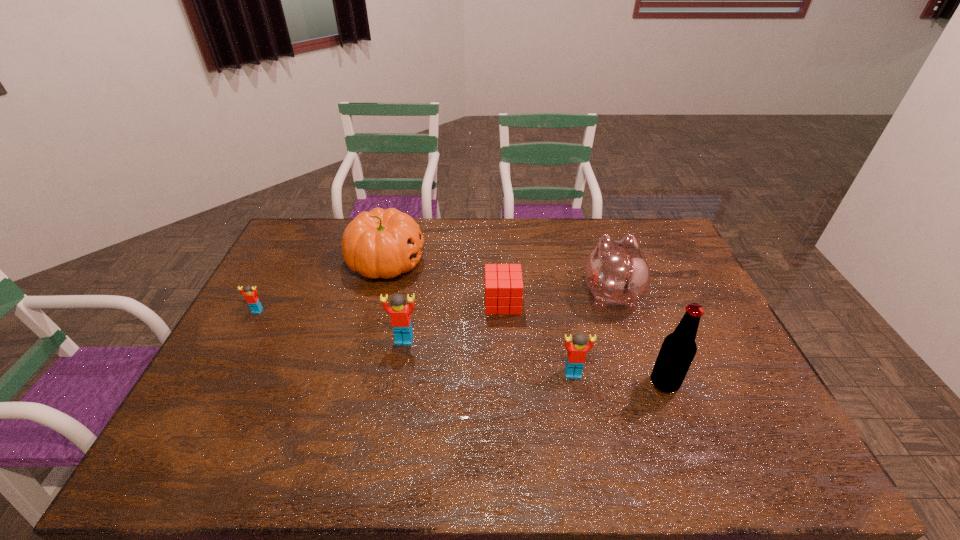
What are the coordinates of `vacant space positioned 0.190m on the face of the farthest Lego` in the screenshot? It's located at [229, 363].

Where is `vacant space located 0.250m on the face of the second farthest Lego`? This screenshot has height=540, width=960. vacant space located 0.250m on the face of the second farthest Lego is located at coordinates (390, 424).

This screenshot has height=540, width=960. Find the location of `free space located 0.070m on the face of the second shortest Lego`. free space located 0.070m on the face of the second shortest Lego is located at coordinates (579, 402).

Image resolution: width=960 pixels, height=540 pixels. What are the coordinates of `free space located 0.120m on the back of the fourth object from left to right` in the screenshot? It's located at (500, 267).

The width and height of the screenshot is (960, 540). In order to click on free space located on the carved face of the pumpkin in this screenshot , I will do (x=492, y=262).

Locate an element on the screen. The width and height of the screenshot is (960, 540). free space located on the front facing side of the piggy bank is located at coordinates (600, 262).

The image size is (960, 540). In order to click on vacant space located on the front facing side of the piggy bank in this screenshot , I will do `click(588, 225)`.

Find the location of a particular element. The image size is (960, 540). free space located 0.230m on the front facing side of the piggy bank is located at coordinates (590, 233).

Identify the location of free region located 0.390m on the back of the beer bottle. The image size is (960, 540). (624, 277).

This screenshot has height=540, width=960. What are the coordinates of `object that is positioned at the far edge` in the screenshot? It's located at (380, 243).